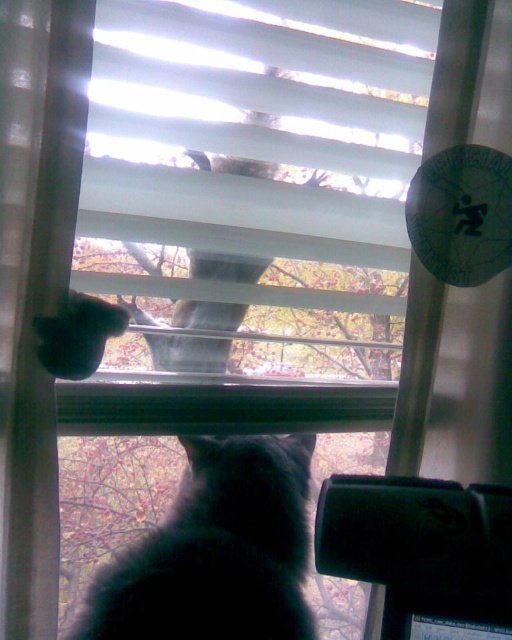
Which of these two, black fluffy cat at lower center or fuzzy gray cat at upper center, stands taller?

With more height is fuzzy gray cat at upper center.

Where is `black fluffy cat at lower center`? Image resolution: width=512 pixels, height=640 pixels. black fluffy cat at lower center is located at coordinates (216, 550).

You are a GUI agent. You are given a task and a screenshot of the screen. Output one action in this format:
    pyautogui.click(x=<x>, y=<y>)
    Task: Click on the black fluffy cat at lower center
    
    Given the screenshot: What is the action you would take?
    pyautogui.click(x=216, y=550)

Can you confirm if white matte blinds at upper center is wider than fuzzy gray cat at upper center?

Correct, the width of white matte blinds at upper center exceeds that of fuzzy gray cat at upper center.

Is white matte blinds at upper center to the left of fuzzy gray cat at upper center from the viewer's perspective?

In fact, white matte blinds at upper center is to the right of fuzzy gray cat at upper center.

This screenshot has width=512, height=640. Identify the location of white matte blinds at upper center. (257, 168).

Image resolution: width=512 pixels, height=640 pixels. Identify the location of white matte blinds at upper center. (257, 168).

How far apart are white matte blinds at upper center and black fluffy cat at lower center?

white matte blinds at upper center and black fluffy cat at lower center are 39.95 centimeters apart from each other.

Based on the photo, does white matte blinds at upper center have a smaller size compared to black fluffy cat at lower center?

Incorrect, white matte blinds at upper center is not smaller in size than black fluffy cat at lower center.

Image resolution: width=512 pixels, height=640 pixels. Find the location of `white matte blinds at upper center`. white matte blinds at upper center is located at coordinates (257, 168).